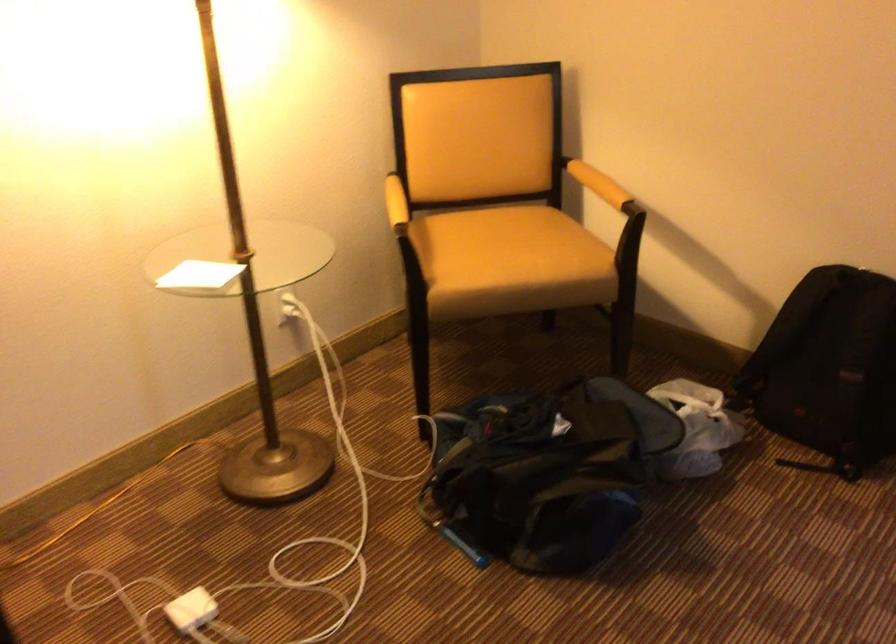
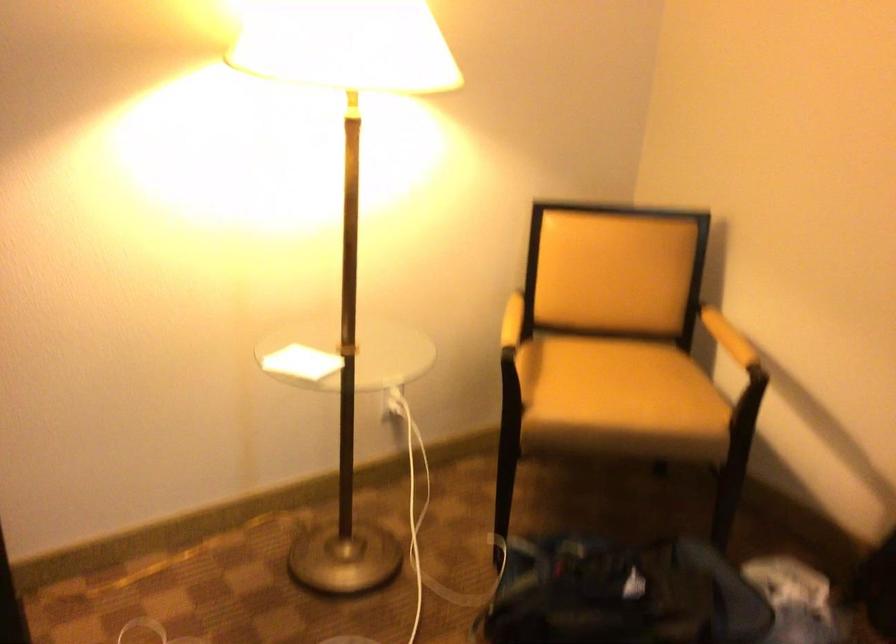
The point at [602,185] is marked in the first image. Where is the corresponding point in the second image?

(728, 337)